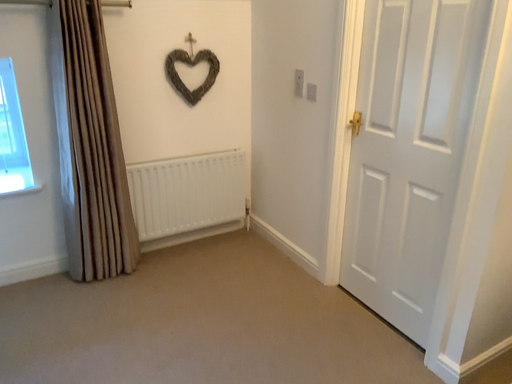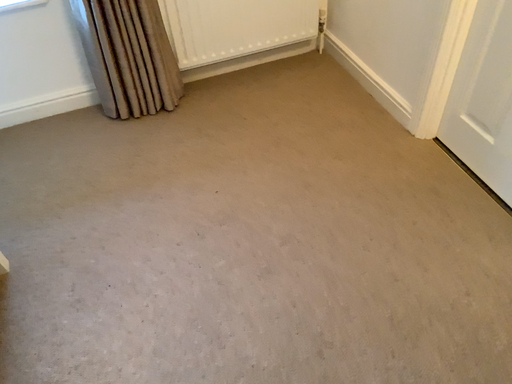
Question: Which way did the camera rotate in the video?

Choices:
 (A) rotated downward
 (B) rotated upward

Answer: (A)